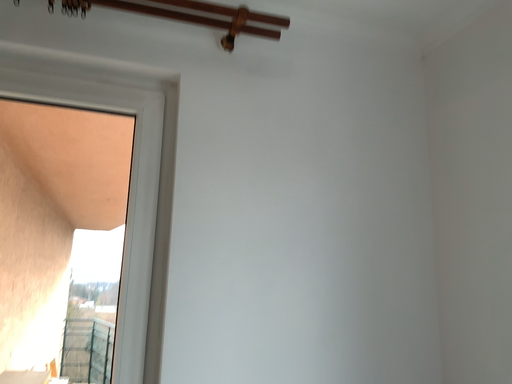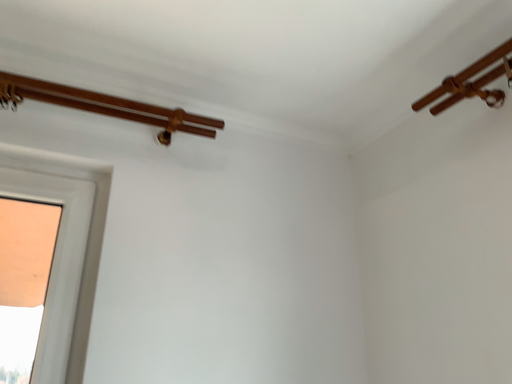
Question: How did the camera likely rotate when shooting the video?

Choices:
 (A) rotated upward
 (B) rotated downward

Answer: (A)